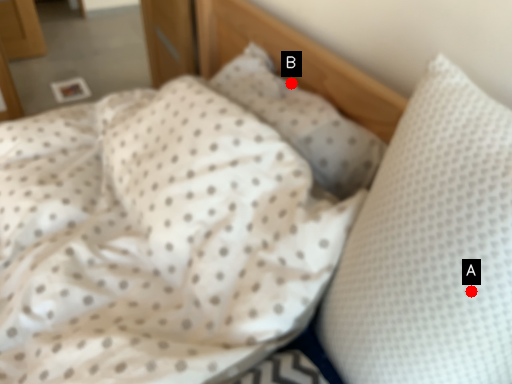
Question: Two points are circled on the image, labeled by A and B beside each circle. Which point appears farthest from the camera in this image?

Choices:
 (A) A is further
 (B) B is further

Answer: (B)